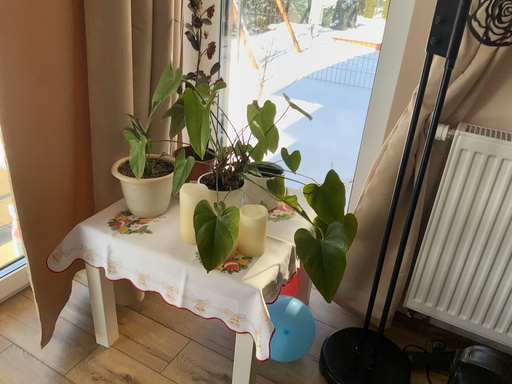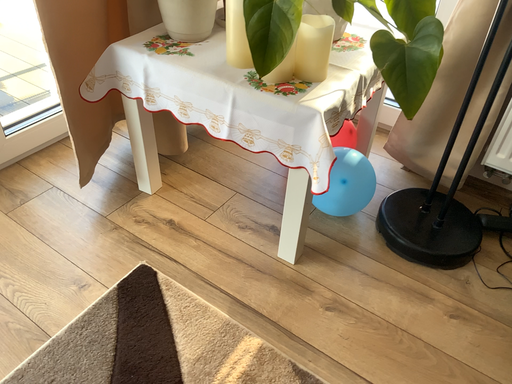
Question: How did the camera likely rotate when shooting the video?

Choices:
 (A) rotated upward
 (B) rotated downward

Answer: (B)